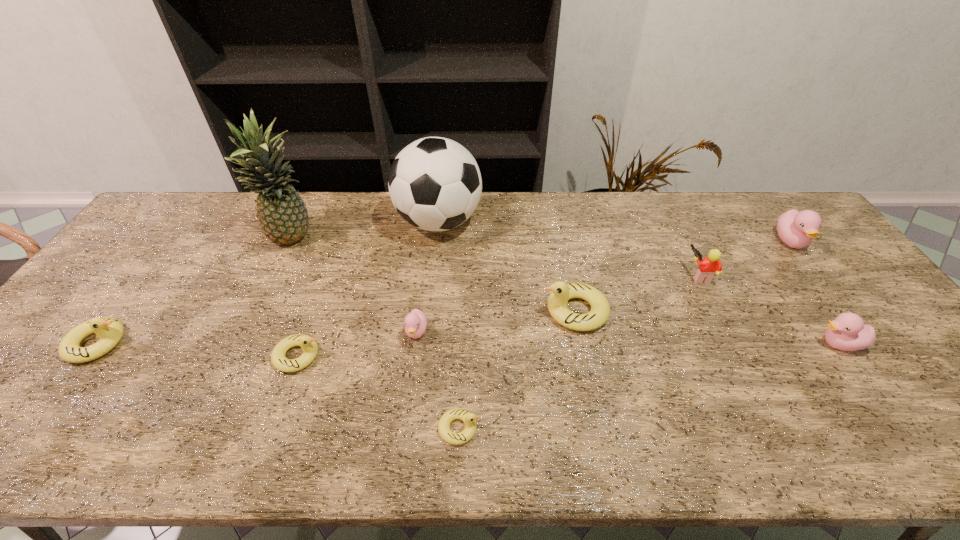
Image resolution: width=960 pixels, height=540 pixels. Identify the location of object located in the far right corner section of the desktop. (x=796, y=229).

You are a GUI agent. You are given a task and a screenshot of the screen. Output one action in this format:
    pyautogui.click(x=<x>, y=<y>)
    Task: Click on the free space at the far edge of the desktop
    This screenshot has width=960, height=540.
    Given the screenshot: What is the action you would take?
    pyautogui.click(x=596, y=211)

The height and width of the screenshot is (540, 960). In the image, there is a desktop. Find the location of `vacant space at the near edge`. vacant space at the near edge is located at coordinates tap(870, 439).

In the image, there is a desktop. Identify the location of vacant space at the left edge. (33, 386).

This screenshot has height=540, width=960. What are the coordinates of `vacant space at the right edge` in the screenshot? It's located at (927, 404).

Where is `free space between the green pineapple and the second tallest object`? The height and width of the screenshot is (540, 960). free space between the green pineapple and the second tallest object is located at coordinates (366, 231).

At what (x,y) coordinates should I click in order to perform the action: click on blank region between the eighth object from left to right and the third yellow duckling from left to right. Please return your answer as a coordinate pair (x, y). The image size is (960, 540). Looking at the image, I should click on (579, 352).

This screenshot has height=540, width=960. Find the location of `free space between the fourth farthest object and the leftmost yellow duckling`. free space between the fourth farthest object and the leftmost yellow duckling is located at coordinates (398, 309).

At what (x,y) coordinates should I click in order to perform the action: click on free space between the farthest duckling and the seventh object from left to right. Please return your answer as a coordinate pair (x, y). Looking at the image, I should click on point(683,276).

Locate an element on the screen. free area in between the biggest pink duckling and the fourth duckling from right to left is located at coordinates [625, 335].